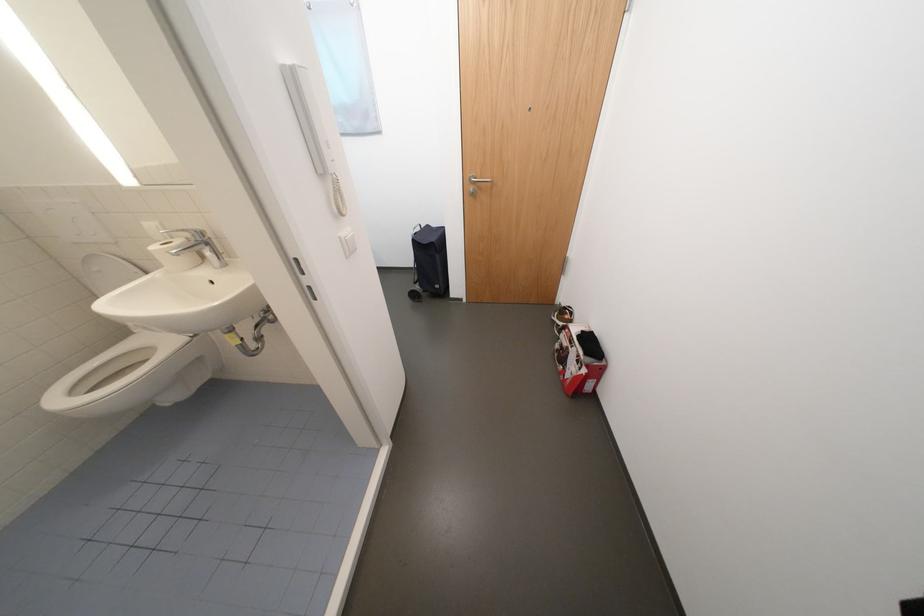
The width and height of the screenshot is (924, 616). Describe the element at coordinates (347, 240) in the screenshot. I see `a white light switch` at that location.